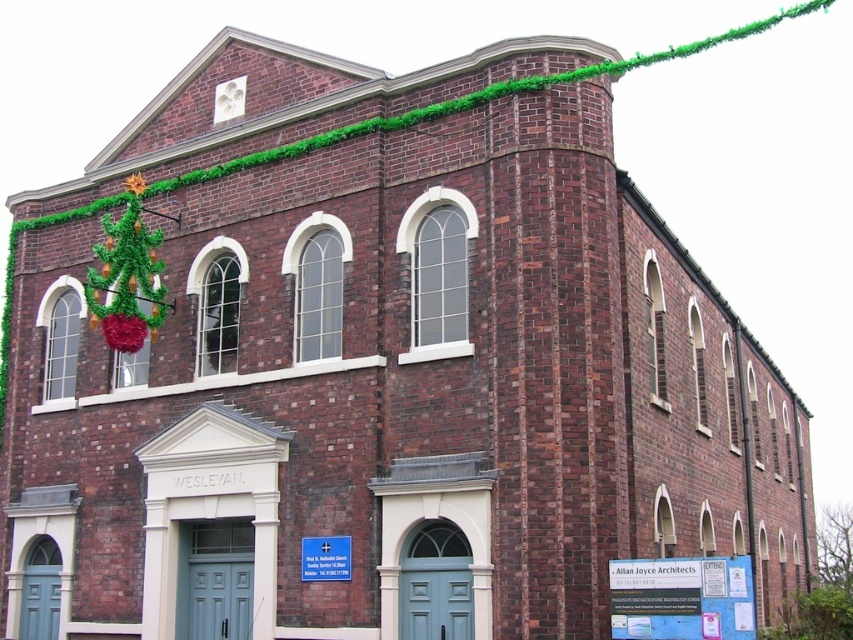
You are an event planner preparing for a holiday event at this building. You need to know which decoration is wider so you can arrange the seating accordingly. Which is wider, the green garland at upper center or the shiny tinsel christmas tree at left?

The green garland at upper center is wider than the shiny tinsel christmas tree at left according to the description.

You are standing in front of the brick building and notice a point marked at coordinates point (490,97). Based on the scene description, can you determine what this point is located on?

The point (490,97) is located on the green garland at upper center.

You are an architect designing a new building and want to place a green garland at upper center exactly where it is in the image. What coordinates should you use?

The green garland at upper center should be placed at coordinates point (490, 97).